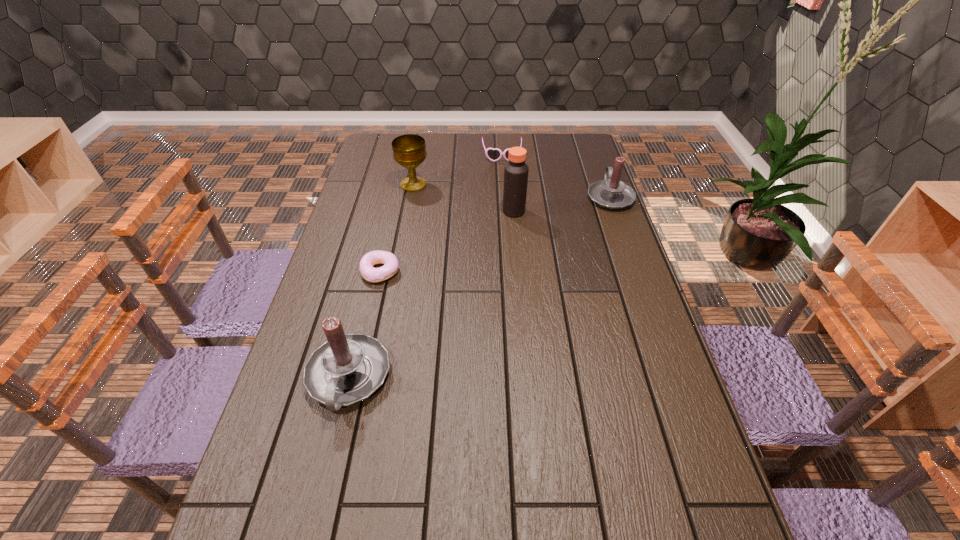
This screenshot has width=960, height=540. I want to click on vacant space that satisfies the following two spatial constraints: 1. on the front-facing side of the sunglasses; 2. on the right side of the vinegar, so click(x=506, y=211).